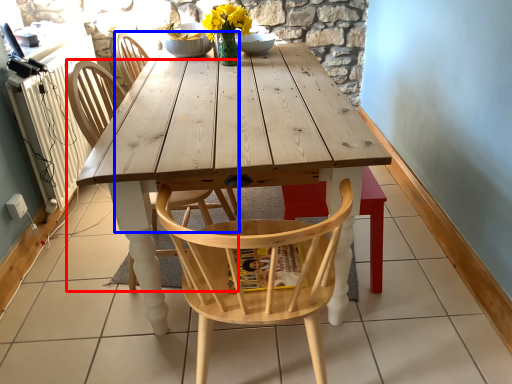
Question: Which of the following is the farthest to the observer, chair (highlighted by a red box) or chair (highlighted by a blue box)?

Choices:
 (A) chair
 (B) chair

Answer: (B)